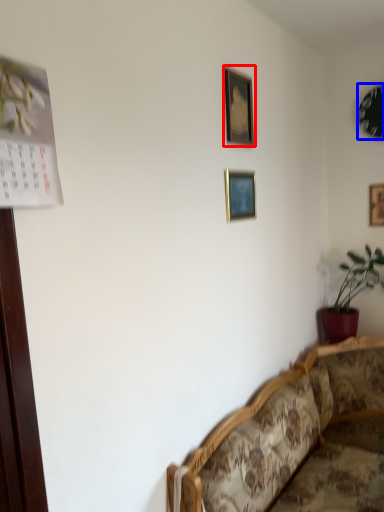
Question: Which of the following is the closest to the observer, picture frame (highlighted by a red box) or picture frame (highlighted by a blue box)?

Choices:
 (A) picture frame
 (B) picture frame

Answer: (A)